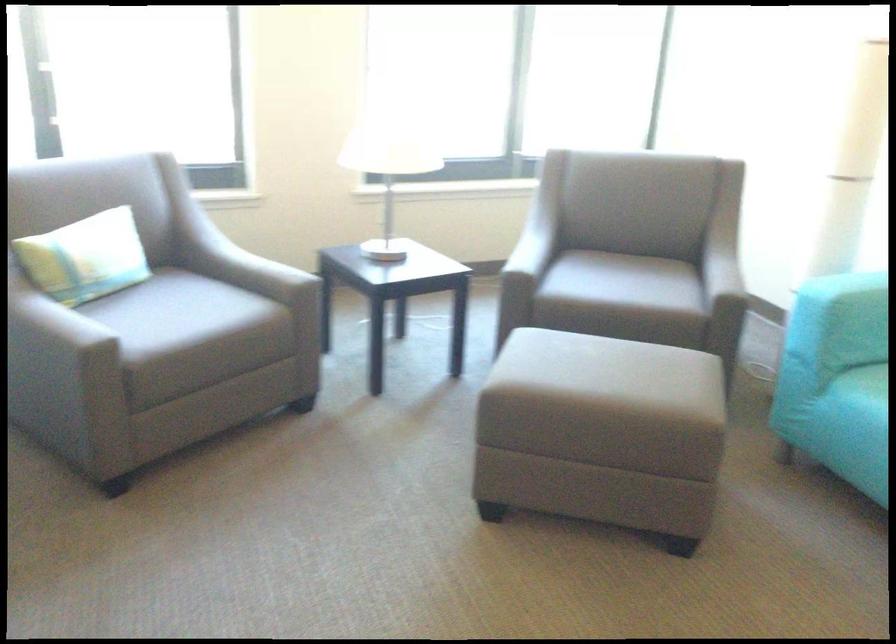
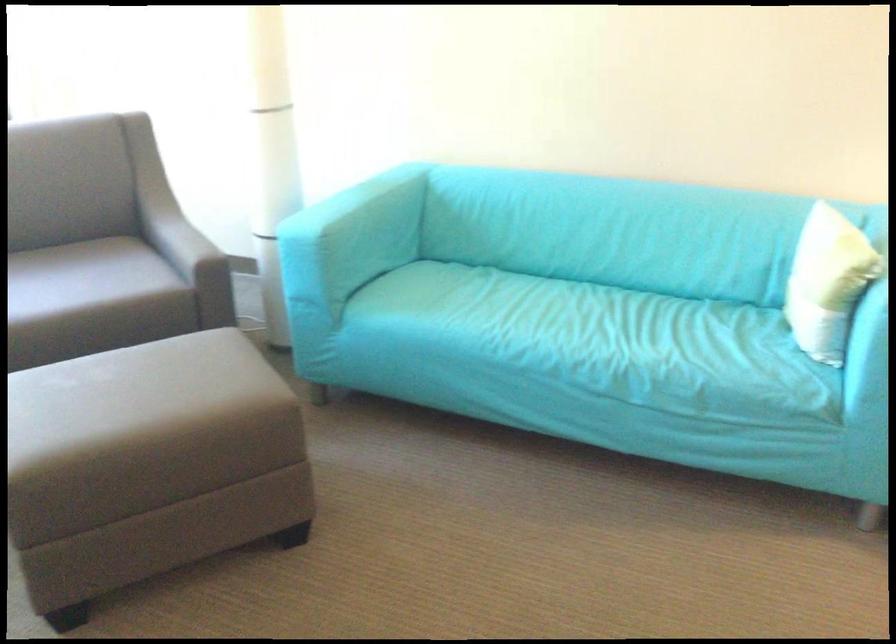
In the second image, find the point that corresponds to (599,290) in the first image.

(53, 298)